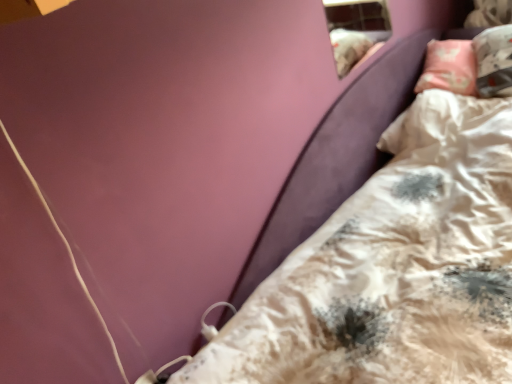
Question: In the image, is velvet purple bed at lower right positioned in front of or behind transparent glass window at upper right?

Choices:
 (A) behind
 (B) front

Answer: (B)

Question: From the image's perspective, is velvet purple bed at lower right located above or below transparent glass window at upper right?

Choices:
 (A) above
 (B) below

Answer: (B)

Question: From their relative heights in the image, would you say velvet purple bed at lower right is taller or shorter than transparent glass window at upper right?

Choices:
 (A) short
 (B) tall

Answer: (A)

Question: In the image, is transparent glass window at upper right positioned in front of or behind velvet purple bed at lower right?

Choices:
 (A) front
 (B) behind

Answer: (B)

Question: From a real-world perspective, is transparent glass window at upper right above or below velvet purple bed at lower right?

Choices:
 (A) below
 (B) above

Answer: (B)

Question: In terms of height, does transparent glass window at upper right look taller or shorter compared to velvet purple bed at lower right?

Choices:
 (A) tall
 (B) short

Answer: (A)

Question: Looking at their shapes, would you say transparent glass window at upper right is wider or thinner than velvet purple bed at lower right?

Choices:
 (A) wide
 (B) thin

Answer: (B)